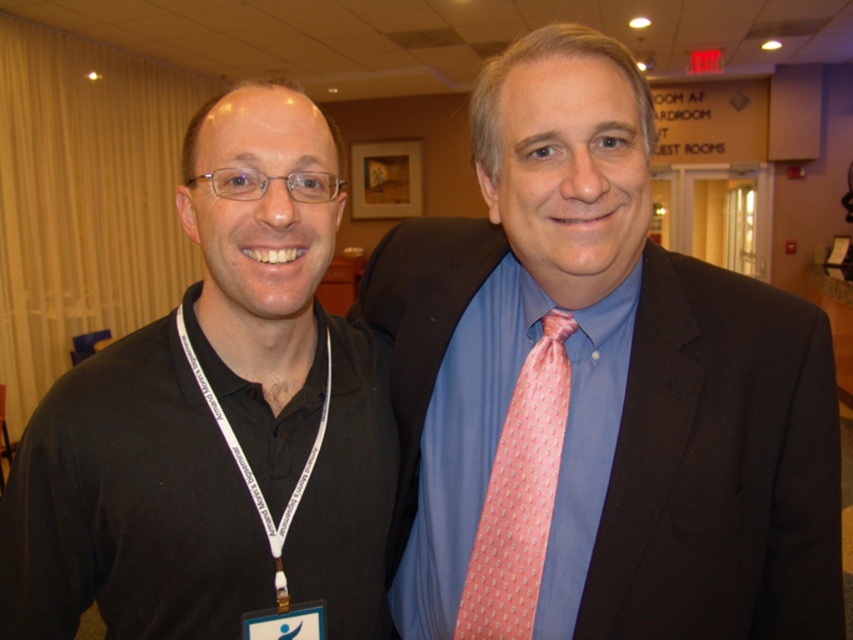
You are trying to find the black lanyard at left in the image. According to the coordinates provided, where exactly is it positioned?

The black lanyard at left is located at point [215,419].

You are standing at the point with coordinates point (544, 426) and want to move to the point with coordinates point (380, 451). Can you walk directly towards it without any obstacles?

Yes, because point (380, 451) is behind point (544, 426), so there are no obstacles blocking the path between them.

You are at a conference and need to decide which tie to wear for a presentation. You have two options in front of you. The pink dotted tie at center and the pink silk tie at center. Which one is taller?

The pink dotted tie at center is taller than the pink silk tie at center.